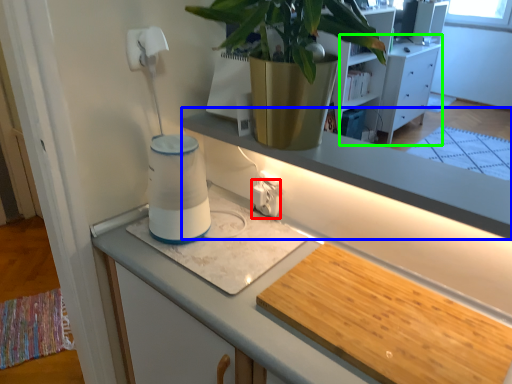
Question: Considering the real-world distances, which object is farthest from electric outlet (highlighted by a red box)? window sill (highlighted by a blue box) or dresser (highlighted by a green box)?

Choices:
 (A) window sill
 (B) dresser

Answer: (B)